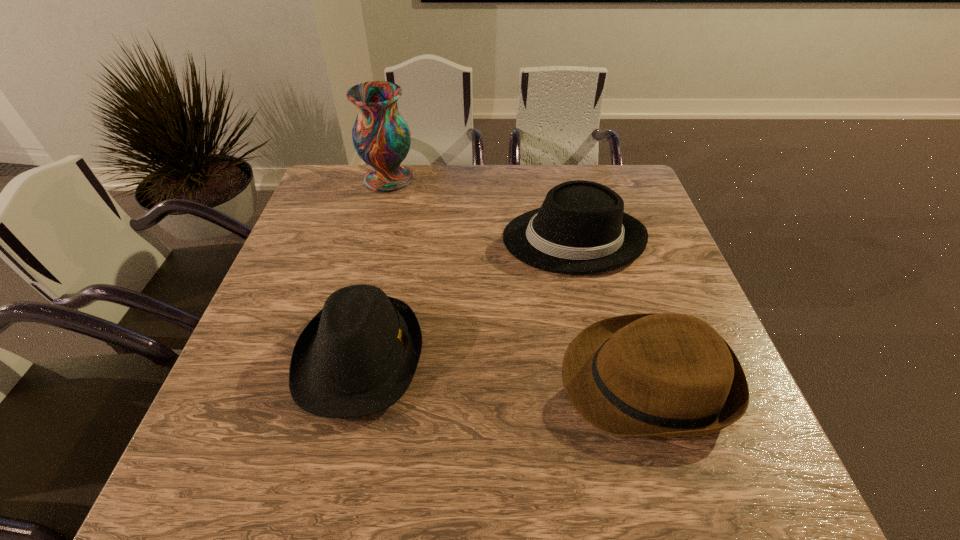
This screenshot has height=540, width=960. Find the location of `the farthest object`. the farthest object is located at coordinates (381, 137).

This screenshot has height=540, width=960. Find the location of `the tallest object`. the tallest object is located at coordinates (381, 137).

Find the location of `the farthest fedora`. the farthest fedora is located at coordinates (581, 228).

I want to click on the leftmost fedora, so click(x=358, y=355).

Where is `free space located on the front of the vase`? This screenshot has width=960, height=540. free space located on the front of the vase is located at coordinates (376, 225).

Where is `free space located 0.380m on the front-facing side of the second farthest object`? The image size is (960, 540). free space located 0.380m on the front-facing side of the second farthest object is located at coordinates point(363,239).

The height and width of the screenshot is (540, 960). Identify the location of vacant space located on the front-facing side of the second farthest object. (393, 239).

This screenshot has height=540, width=960. I want to click on free space located 0.260m on the front-facing side of the second farthest object, so [407, 239].

Find the location of a particular element. vacant space situated 0.100m on the front-facing side of the leftmost fedora is located at coordinates (470, 357).

Where is `vase that is at the far edge`? vase that is at the far edge is located at coordinates (381, 137).